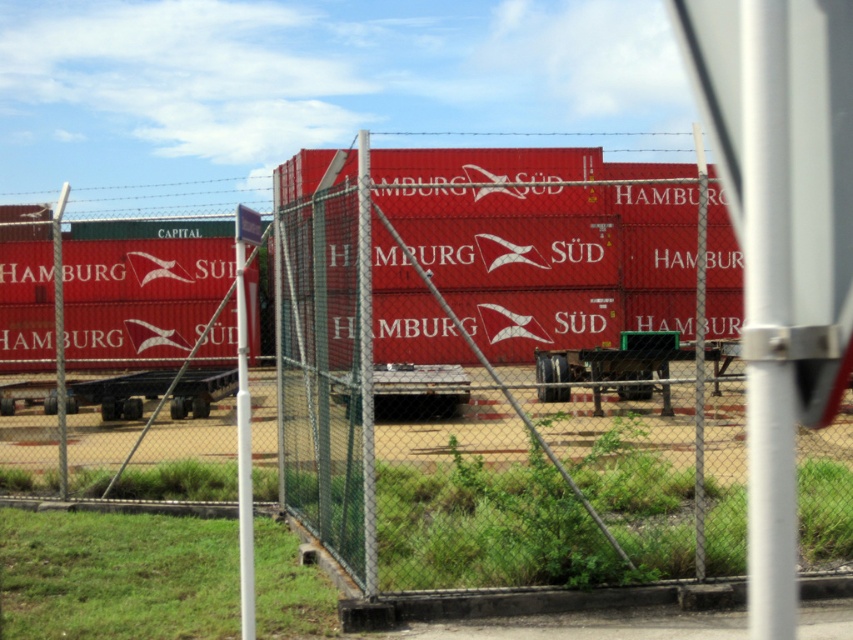
Who is higher up, green metallic trailer truck at center or metallic trailer truck at center?

metallic trailer truck at center is above.

Is point (543, 365) more distant than point (448, 413)?

Yes.

You are a GUI agent. You are given a task and a screenshot of the screen. Output one action in this format:
    pyautogui.click(x=<x>, y=<y>)
    Task: Click on the green metallic trailer truck at center
    Image resolution: width=853 pixels, height=640 pixels.
    Given the screenshot: What is the action you would take?
    pyautogui.click(x=610, y=358)

Does metal mesh fence at center have a lesser width compared to metallic trailer truck at center?

In fact, metal mesh fence at center might be wider than metallic trailer truck at center.

Is point (479, 209) more distant than point (378, 417)?

Yes, point (479, 209) is farther from viewer.

Between point (350, 211) and point (431, 401), which one is positioned in front?

Point (350, 211)

Where is `metal mesh fence at center`? This screenshot has width=853, height=640. metal mesh fence at center is located at coordinates (503, 364).

Is point (503, 563) positioned behind point (625, 397)?

No, (503, 563) is closer to viewer.

Who is more forward, [585,321] or [596,397]?

Point [596,397] is in front.

Where is `metal mesh fence at center`? metal mesh fence at center is located at coordinates (503, 364).